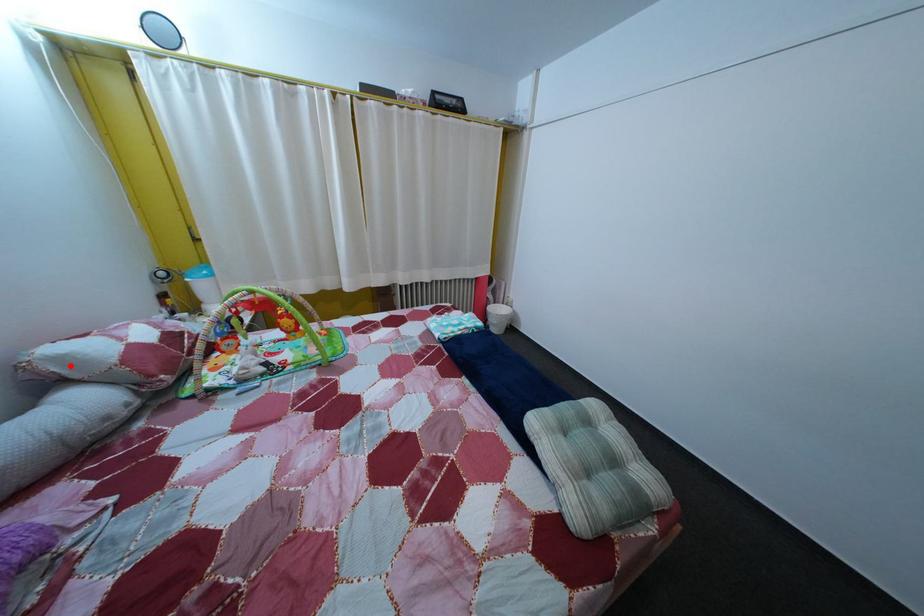
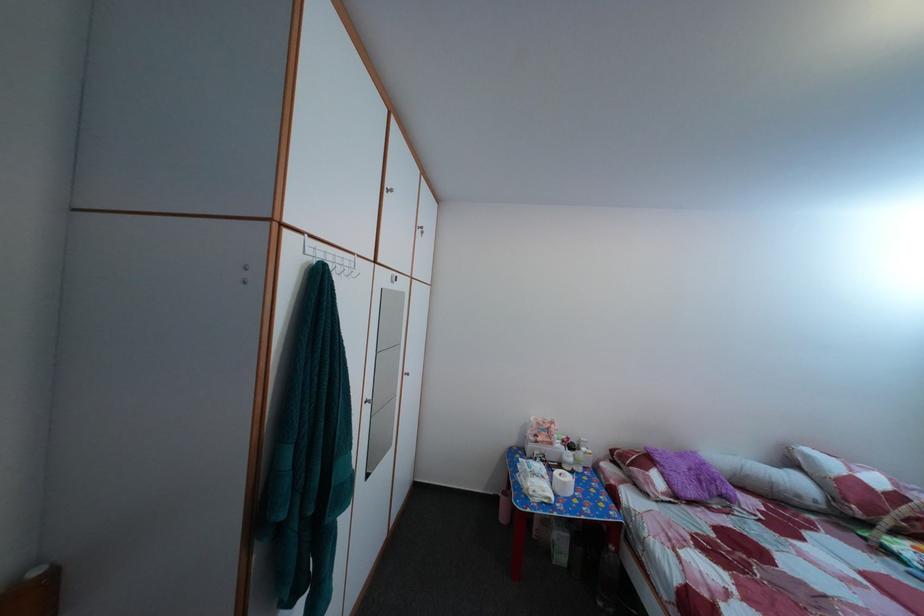
The point at the highlighted location is marked in the first image. Where is the corresponding point in the second image?

(817, 464)